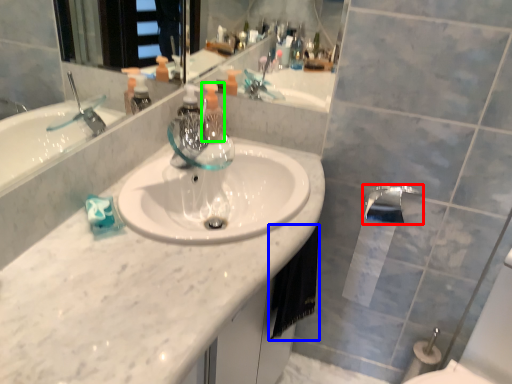
Question: Which object is positioned farthest from tap (highlighted by a red box)? Select from hand towel (highlighted by a blue box) and soap dispenser (highlighted by a green box).

Choices:
 (A) hand towel
 (B) soap dispenser

Answer: (B)